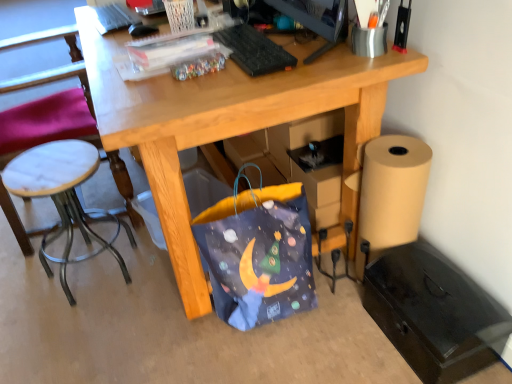
Question: Is black plastic keyboard at upper center wider or thinner than blue fabric bag at lower center?

Choices:
 (A) wide
 (B) thin

Answer: (B)

Question: Choose the correct answer: Is black plastic keyboard at upper center inside blue fabric bag at lower center or outside it?

Choices:
 (A) outside
 (B) inside

Answer: (A)

Question: Estimate the real-world distances between objects in this image. Which object is closer to the white marble stool at left?

Choices:
 (A) black matte file cabinet at lower right
 (B) white marble stool at left
 (C) black plastic keyboard at upper center
 (D) blue fabric bag at lower center
 (E) black plastic monitor at upper center

Answer: (B)

Question: Which object is the closest to the white marble stool at left?

Choices:
 (A) black plastic monitor at upper center
 (B) black plastic keyboard at upper center
 (C) black matte file cabinet at lower right
 (D) blue fabric bag at lower center
 (E) white marble stool at left

Answer: (E)